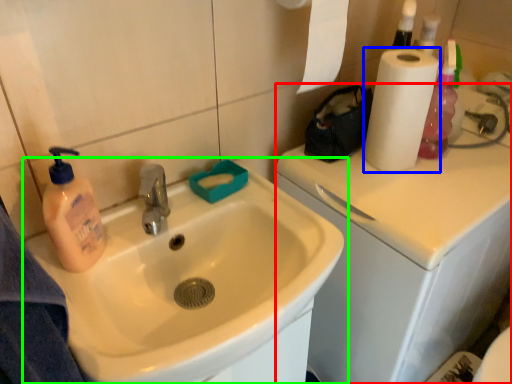
Question: Based on their relative distances, which object is nearer to counter top (highlighted by a red box)? Choose from paper towel (highlighted by a blue box) and sink (highlighted by a green box).

Choices:
 (A) paper towel
 (B) sink

Answer: (A)